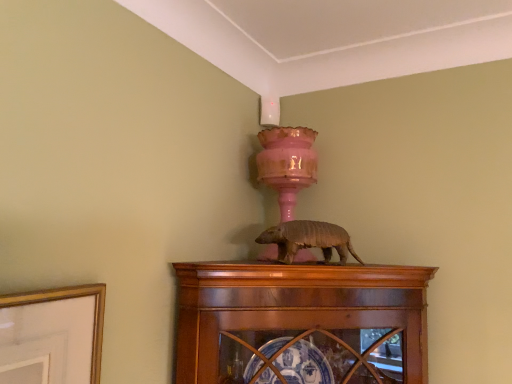
Locate an element on the screen. vacant point above brown matte armadillo at center (from a real-world perspective) is located at coordinates point(311,228).